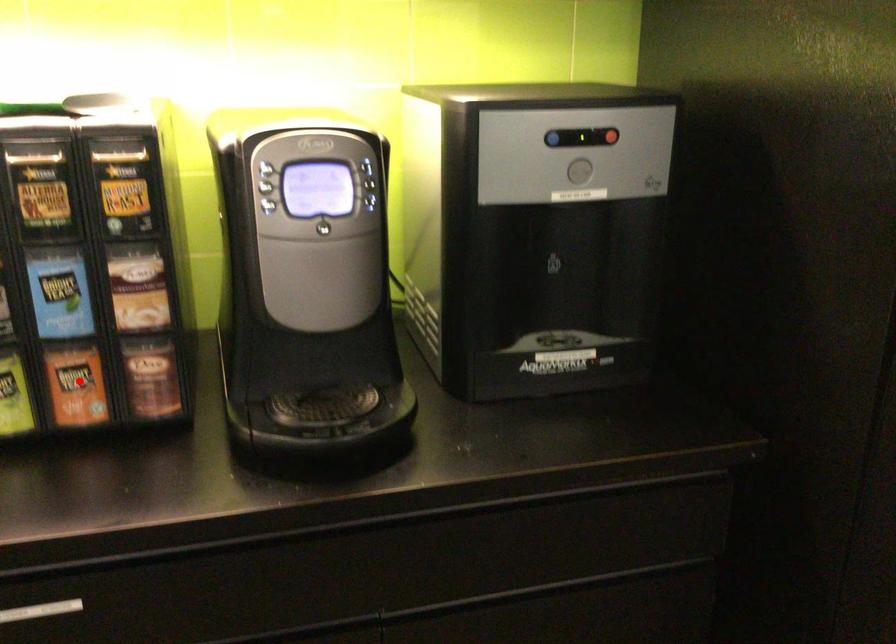
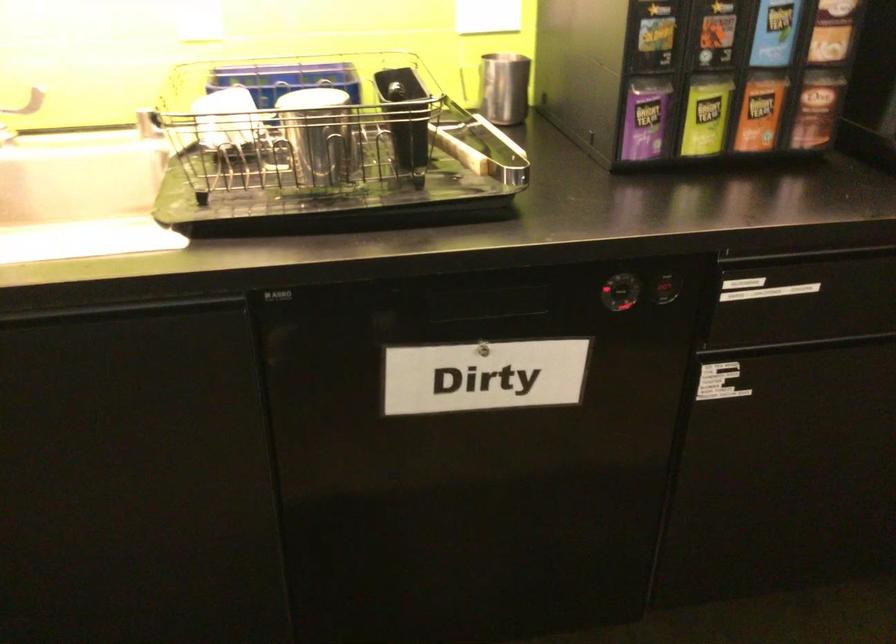
The point at the highlighted location is marked in the first image. Where is the corresponding point in the second image?

(760, 111)